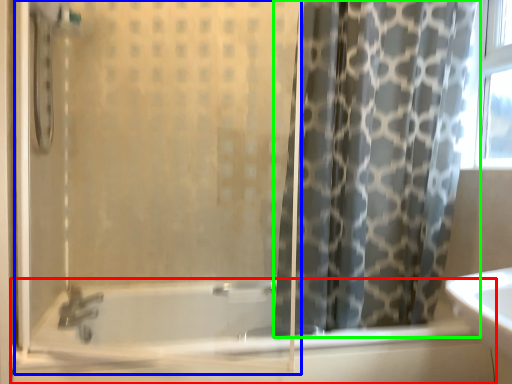
Question: Which is farther away from bathtub (highlighted by a red box)? screen door (highlighted by a blue box) or curtain (highlighted by a green box)?

Choices:
 (A) screen door
 (B) curtain

Answer: (B)